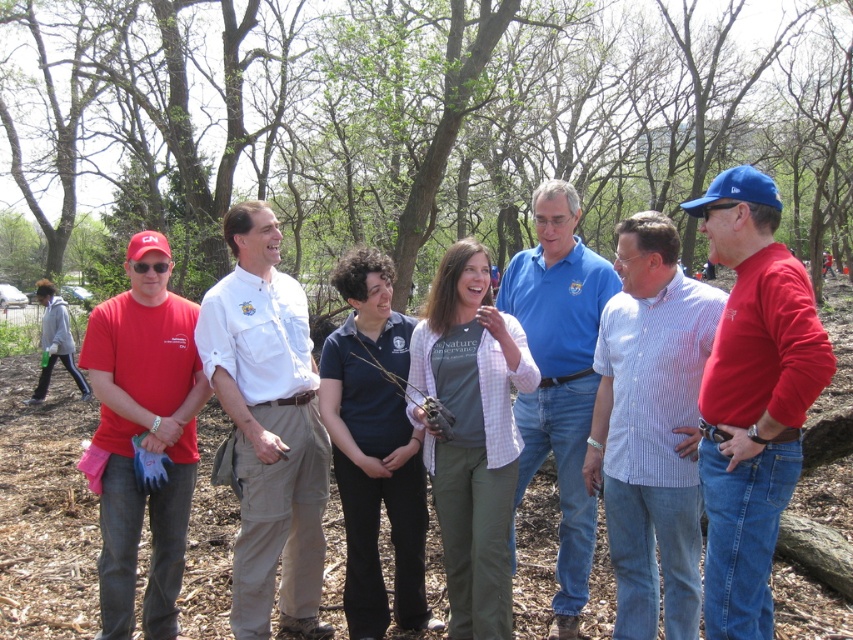
Does matte red t-shirt at left appear on the left side of plaid shirt at center?

Correct, you'll find matte red t-shirt at left to the left of plaid shirt at center.

Can you confirm if matte red t-shirt at left is taller than plaid shirt at center?

Yes.

The height and width of the screenshot is (640, 853). What are the coordinates of `matte red t-shirt at left` in the screenshot? It's located at (144, 433).

Locate an element on the screen. matte red t-shirt at left is located at coordinates (144, 433).

Who is positioned more to the right, white striped shirt at center or matte red t-shirt at left?

white striped shirt at center

Between white striped shirt at center and matte red t-shirt at left, which one has less height?

white striped shirt at center

What are the coordinates of `white striped shirt at center` in the screenshot? It's located at (651, 428).

Is green leafy tree at center wider than blue cotton shirt at center?

Indeed, green leafy tree at center has a greater width compared to blue cotton shirt at center.

Which is in front, point (189, 243) or point (561, 378)?

Positioned in front is point (561, 378).

This screenshot has width=853, height=640. What are the coordinates of `green leafy tree at center` in the screenshot? It's located at (410, 122).